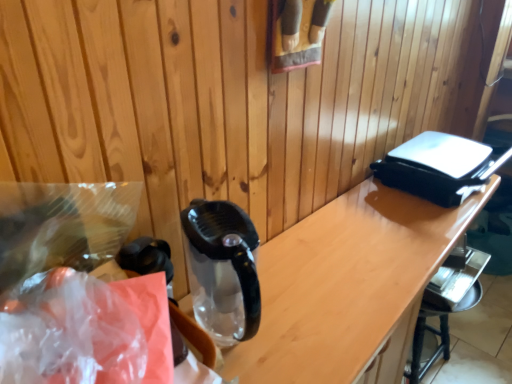
The image size is (512, 384). What are the coordinates of `free point above transparent glass table at center (from a real-world perspective)` in the screenshot? It's located at (370, 254).